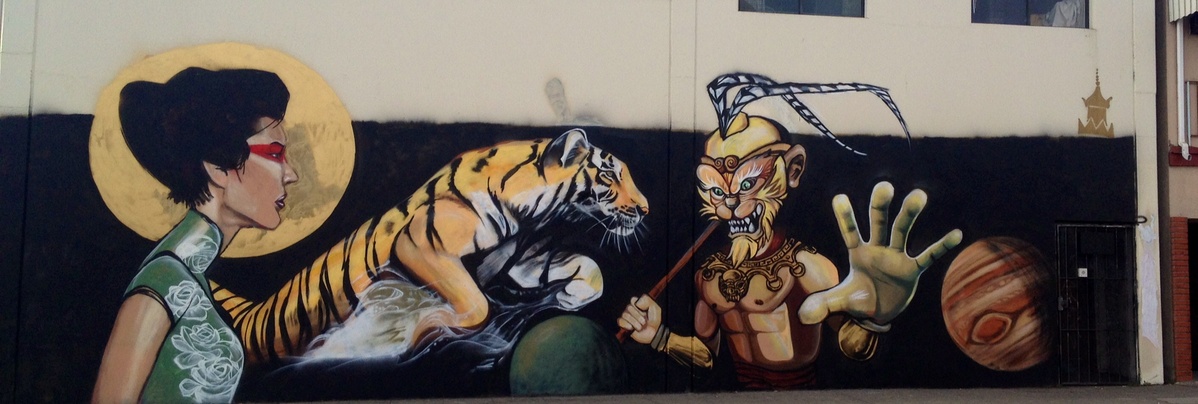
The image size is (1198, 404). I want to click on window, so click(785, 9), click(833, 7), click(980, 3), click(1045, 14).